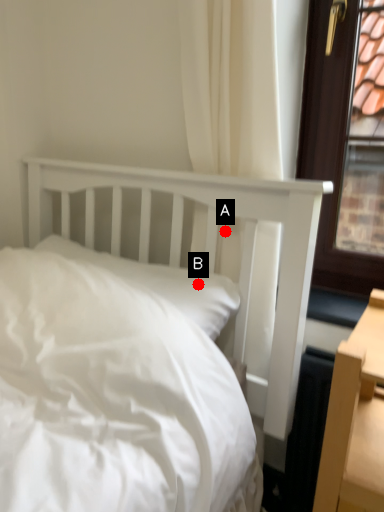
Question: Two points are circled on the image, labeled by A and B beside each circle. Which point is closer to the camera taking this photo?

Choices:
 (A) A is closer
 (B) B is closer

Answer: (B)